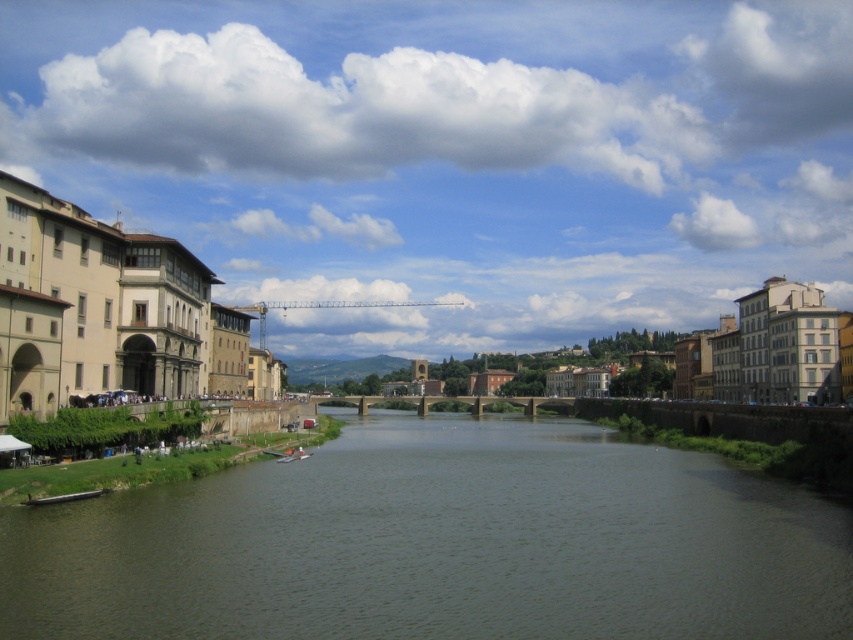
Does brown concrete river at center appear on the right side of wooden boat at lower left?

Yes, brown concrete river at center is to the right of wooden boat at lower left.

Who is taller, brown concrete river at center or wooden boat at lower left?

brown concrete river at center is taller.

This screenshot has height=640, width=853. What are the coordinates of `brown concrete river at center` in the screenshot? It's located at 439,544.

Identify the location of brown concrete river at center. pos(439,544).